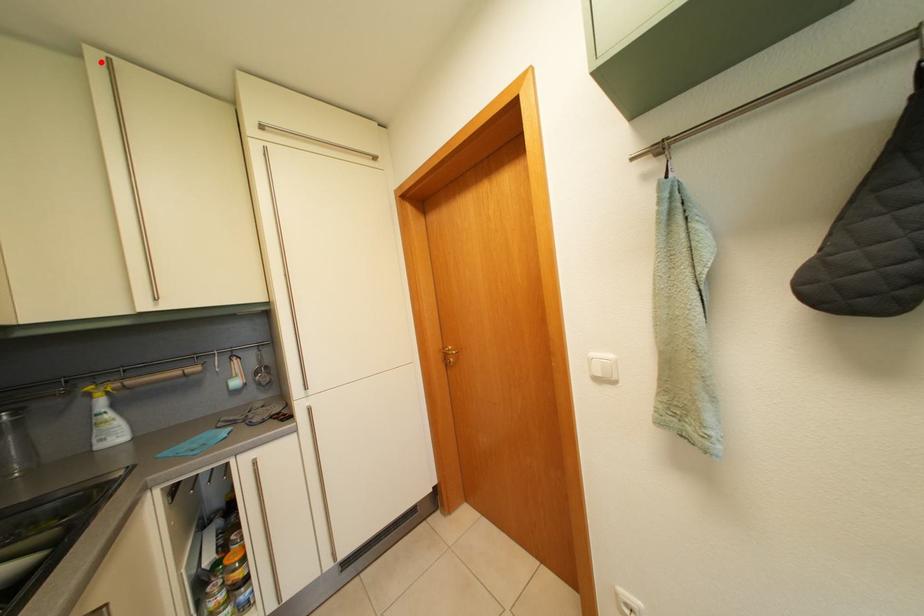
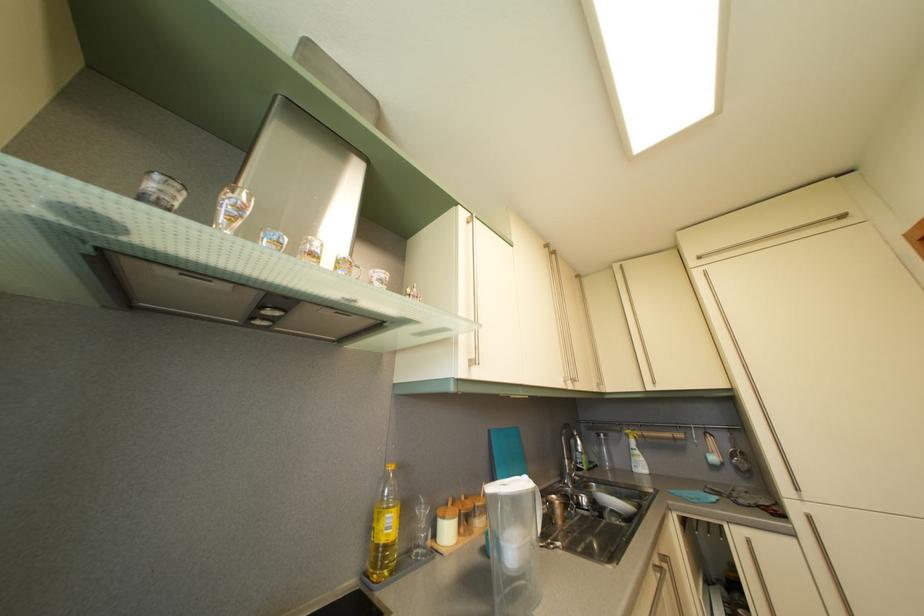
Where in the second image is the point corresponding to the highlighted location from the first image?

(624, 274)